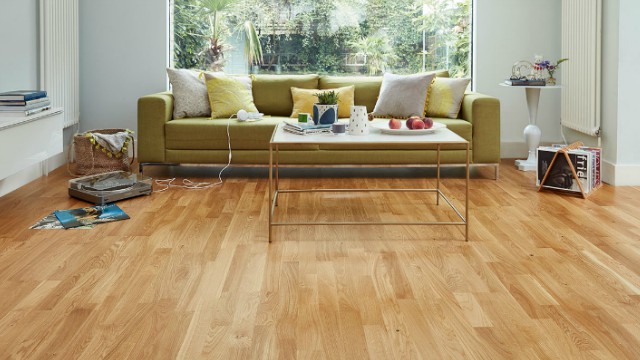
Locate an element on the screen. The height and width of the screenshot is (360, 640). hardwood floor is located at coordinates (310, 277).